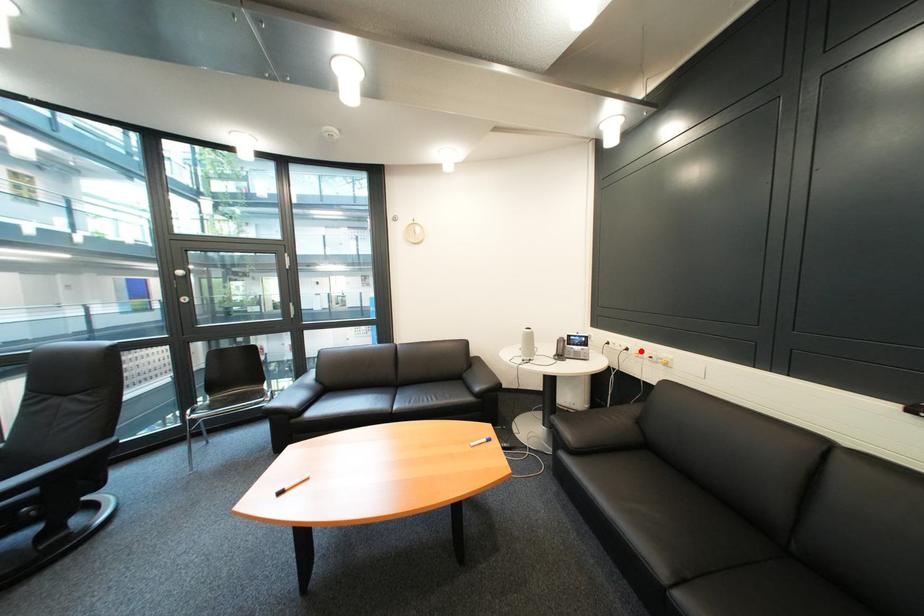
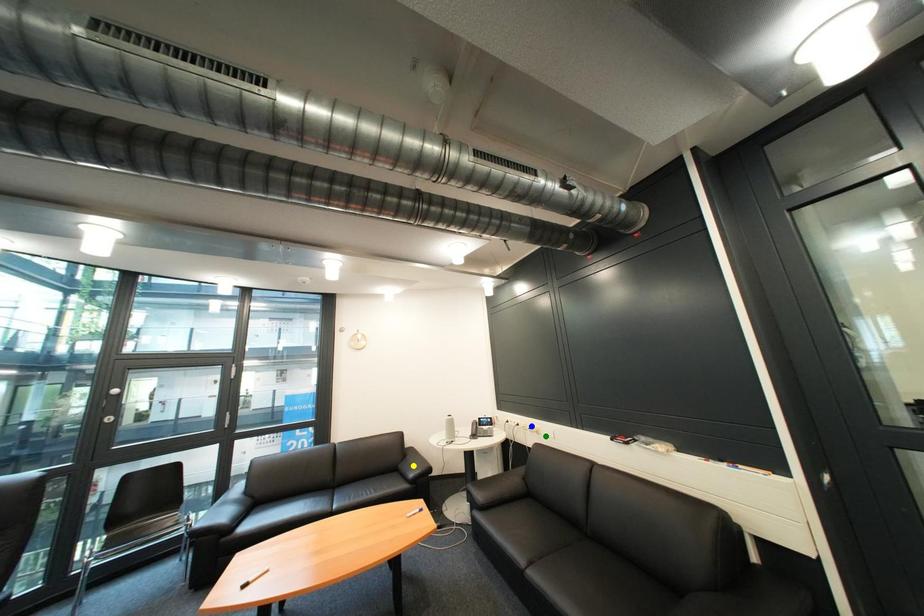
Question: I am providing you with two images of the same scene from different viewpoints. A red point is marked on the first image. You are given multiple points on the second image. Which point in image 2 is actually the same real-world point as the red point in image 1?

Choices:
 (A) blue point
 (B) green point
 (C) yellow point

Answer: (A)